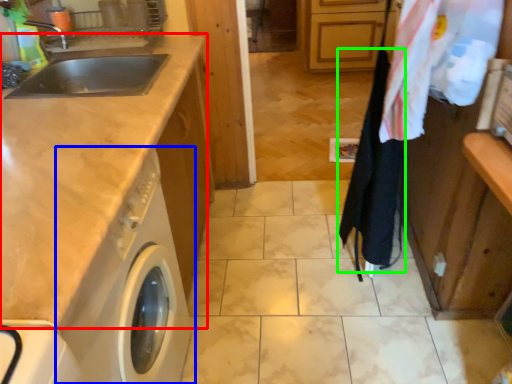
Question: Which object is positioned farthest from countertop (highlighted by a red box)? Select from washing machine (highlighted by a blue box) and clothesline (highlighted by a green box).

Choices:
 (A) washing machine
 (B) clothesline

Answer: (B)